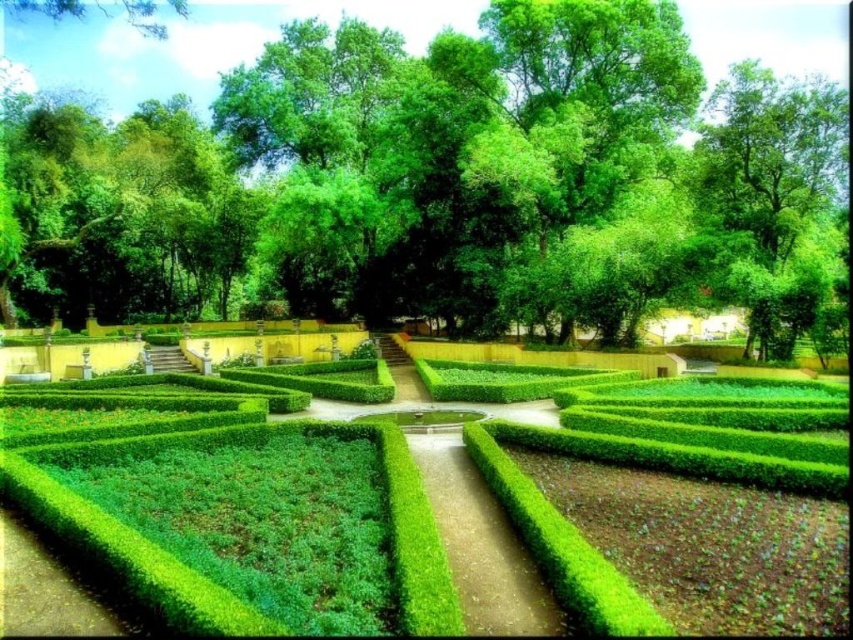
Question: Which object appears farthest from the camera in this image?

Choices:
 (A) green hedge maze at center
 (B) green leafy tree at upper center
 (C) green hedge at center

Answer: (B)

Question: Which object is closer to the camera taking this photo?

Choices:
 (A) green hedge at center
 (B) green leafy tree at upper center
 (C) green hedge maze at center

Answer: (C)

Question: Can you confirm if green leafy tree at upper center is thinner than green hedge maze at center?

Choices:
 (A) yes
 (B) no

Answer: (B)

Question: Does green hedge maze at center appear under green hedge at center?

Choices:
 (A) yes
 (B) no

Answer: (B)

Question: Which point is closer to the camera?

Choices:
 (A) green hedge at center
 (B) green hedge maze at center

Answer: (B)

Question: Is green hedge maze at center below green hedge at center?

Choices:
 (A) no
 (B) yes

Answer: (A)